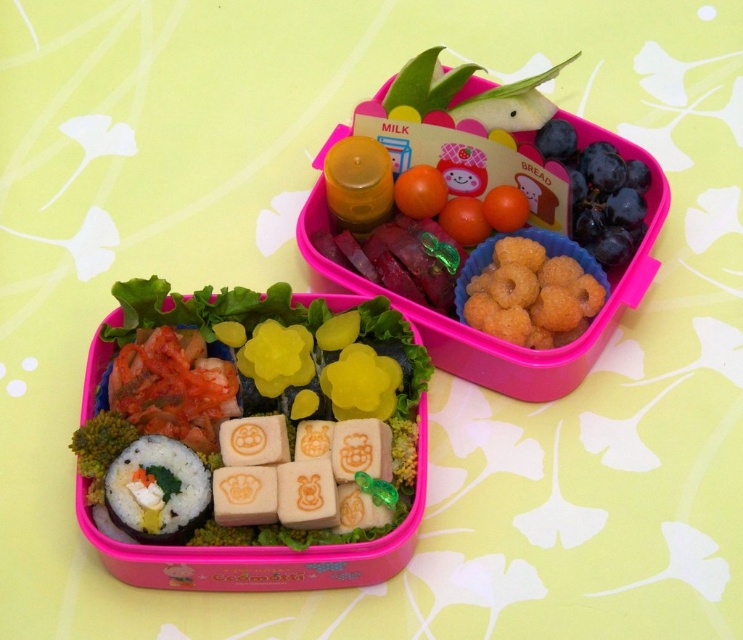
Question: Which object is farther from the camera taking this photo?

Choices:
 (A) white rice with fish filling at lower left
 (B) white rice with sushi at lower left

Answer: (A)

Question: Does white rice with sushi at lower left have a lesser width compared to white rice with fish filling at lower left?

Choices:
 (A) no
 (B) yes

Answer: (A)

Question: Does white rice with sushi at lower left have a larger size compared to white rice with fish filling at lower left?

Choices:
 (A) no
 (B) yes

Answer: (B)

Question: Is white rice with sushi at lower left closer to camera compared to white rice with fish filling at lower left?

Choices:
 (A) no
 (B) yes

Answer: (B)

Question: Which of the following is the closest to the observer?

Choices:
 (A) (166, 470)
 (B) (452, 326)

Answer: (A)

Question: Which of the following is the farthest from the observer?

Choices:
 (A) white rice with fish filling at lower left
 (B) white rice with sushi at lower left

Answer: (A)